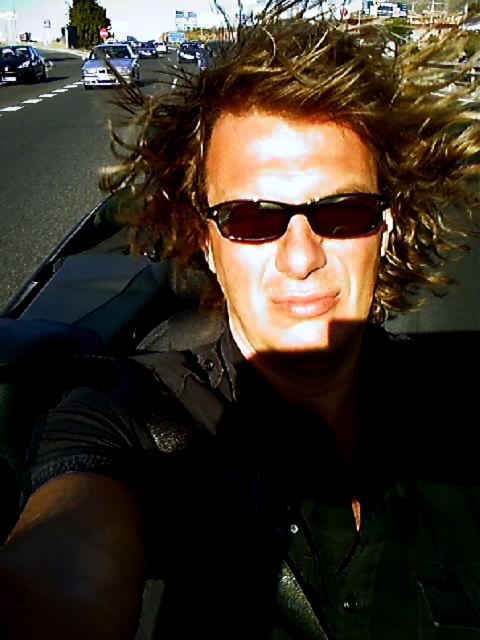
You are driving a car and want to pass the shiny black sedan at left in front of you. The speed limit here is 60 km per hour. Can you safely pass the sedan within the next 10 seconds?

The shiny black sedan at left and viewer are 29.20 meters apart. To safely pass, you need to calculate the distance and time. At 60 km per hour, your speed is approximately 16.67 meters per second. In 10 seconds, you would cover 166.7 meters, which is more than enough to pass the 29.20 meters distance. However, passing should only occur if it is legally allowed and safe, considering oncoming traffic and road conditions.

You are a photographer trying to capture a wide shot of the scene. Given that the brown curly hair at center and the silver metallic sedan at upper left are both in the frame, which object should you focus on to ensure it takes up more of the photo?

The silver metallic sedan at upper left should be focused on because it occupies more space in the frame than the brown curly hair at center.

Looking at this image, you are a photographer trying to capture a wide shot of the scene. The camera you are using has a maximum width capacity of 1.2 meters. Based on the image, will the brown curly hair at center and the silver metallic sedan at upper left fit within the camera frame?

The brown curly hair at center might be wider than silver metallic sedan at upper left, so it is uncertain if both will fit within the camera frame with a maximum width capacity of 1.2 meters. You may need to adjust your position or zoom level to ensure both objects are within the frame.